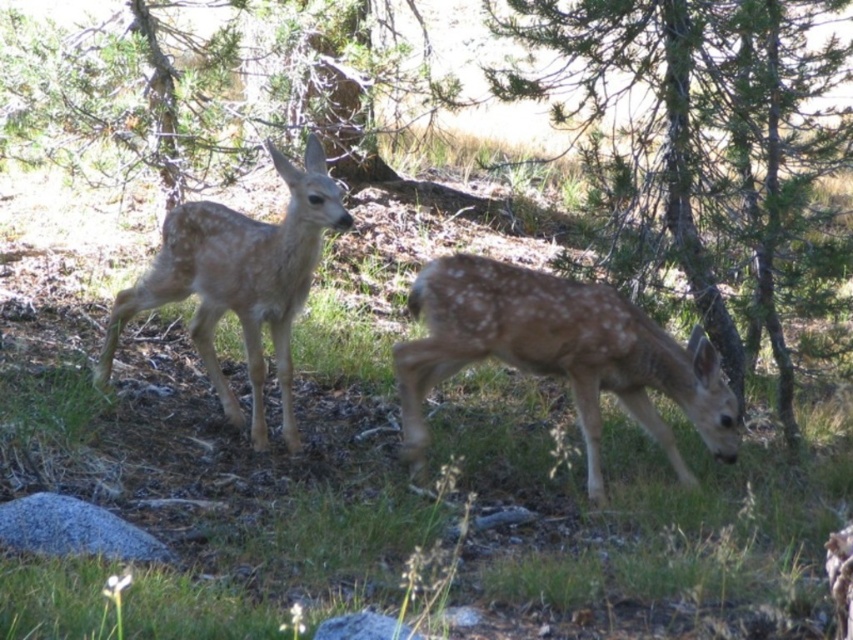
Is spotted fur deer at center to the right of fawn fur fawn at center from the viewer's perspective?

Yes, spotted fur deer at center is to the right of fawn fur fawn at center.

Find the location of a particular element. spotted fur deer at center is located at coordinates (560, 353).

Does green textured tree at center right lie behind fawn fur fawn at center?

Yes, it is.

Does point (759, 301) come closer to viewer compared to point (292, 284)?

No, (759, 301) is behind (292, 284).

The height and width of the screenshot is (640, 853). I want to click on green textured tree at center right, so click(706, 141).

Can you confirm if green textured tree at center right is thinner than spotted fur deer at center?

In fact, green textured tree at center right might be wider than spotted fur deer at center.

Does green textured tree at center right appear on the right side of spotted fur deer at center?

Yes, green textured tree at center right is to the right of spotted fur deer at center.

Who is more forward, [741,228] or [427,378]?

Point [427,378] is more forward.

Where is `green textured tree at center right`? green textured tree at center right is located at coordinates (706, 141).